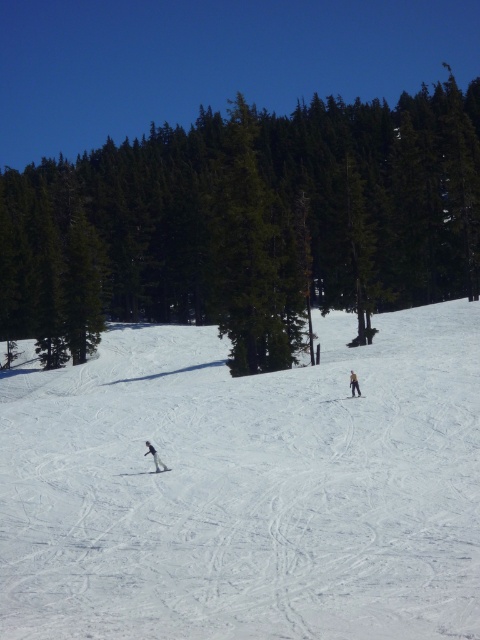
Question: Is white powdery snow at center below black matte ski at center?

Choices:
 (A) no
 (B) yes

Answer: (A)

Question: Which object is closer to the camera taking this photo?

Choices:
 (A) white snowboarder at lower center
 (B) black matte ski at center
 (C) white matte ski at lower left
 (D) green evergreen tree at center

Answer: (A)

Question: Which point is farther to the camera?

Choices:
 (A) white matte ski at lower left
 (B) green evergreen tree at center
 (C) yellowish-green fabric jacket at center-right

Answer: (B)

Question: Which point is farther from the camera taking this photo?

Choices:
 (A) (41, 304)
 (B) (165, 467)

Answer: (A)

Question: Where is white snowboarder at lower center located in relation to black matte ski at center in the image?

Choices:
 (A) above
 (B) below

Answer: (B)

Question: Is the position of green evergreen tree at center more distant than that of yellowish-green fabric jacket at center-right?

Choices:
 (A) no
 (B) yes

Answer: (B)